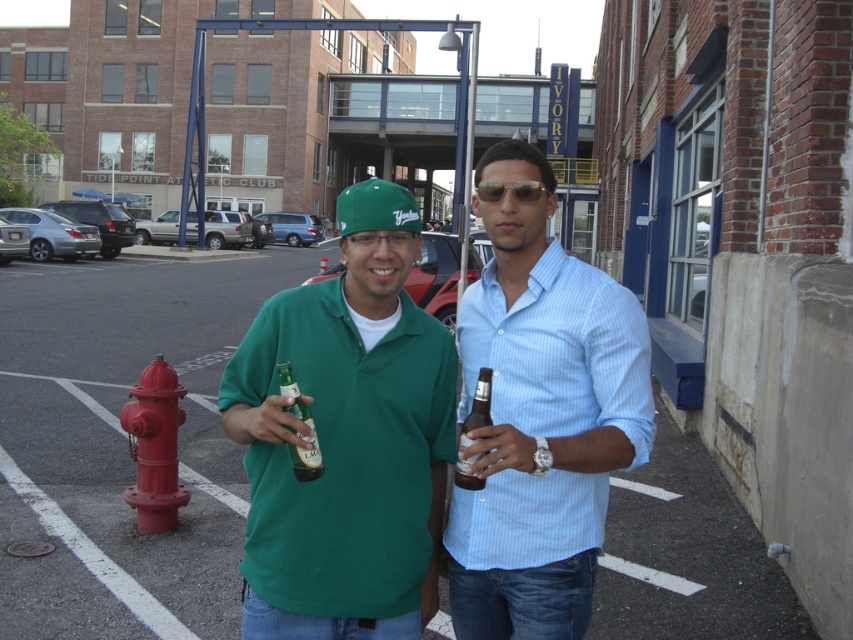
Which is behind, point (329, 534) or point (479, 608)?

Point (479, 608)

Between point (354, 436) and point (463, 557), which one is positioned in front?

Point (354, 436) is in front.

This screenshot has height=640, width=853. I want to click on green matte shirt at center, so click(346, 440).

Who is higher up, green matte shirt at center or gold metallic sunglasses at center?

gold metallic sunglasses at center

Who is positioned more to the left, green matte shirt at center or gold metallic sunglasses at center?

green matte shirt at center is more to the left.

What do you see at coordinates (346, 440) in the screenshot? I see `green matte shirt at center` at bounding box center [346, 440].

Find the location of a particular element. Image resolution: width=853 pixels, height=640 pixels. green matte shirt at center is located at coordinates (346, 440).

From the picture: Is green matte shirt at center above red matte fire hydrant at lower left?

Yes, green matte shirt at center is above red matte fire hydrant at lower left.

Can you confirm if green matte shirt at center is positioned below red matte fire hydrant at lower left?

No, green matte shirt at center is not below red matte fire hydrant at lower left.

Image resolution: width=853 pixels, height=640 pixels. What do you see at coordinates (346, 440) in the screenshot? I see `green matte shirt at center` at bounding box center [346, 440].

Image resolution: width=853 pixels, height=640 pixels. Find the location of `green matte shirt at center`. green matte shirt at center is located at coordinates (346, 440).